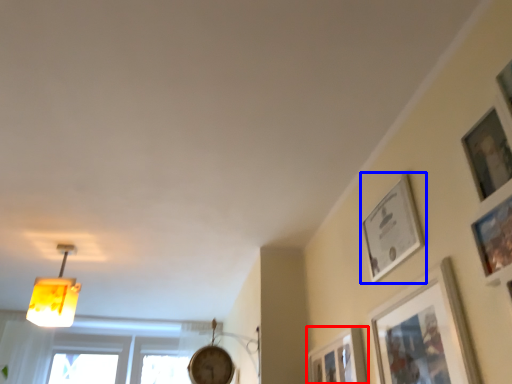
Question: Among these objects, which one is farthest to the camera, picture frame (highlighted by a red box) or picture frame (highlighted by a blue box)?

Choices:
 (A) picture frame
 (B) picture frame

Answer: (A)